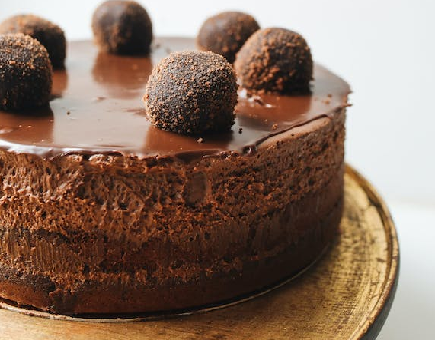
Where is `serving platter`? serving platter is located at coordinates (296, 315).